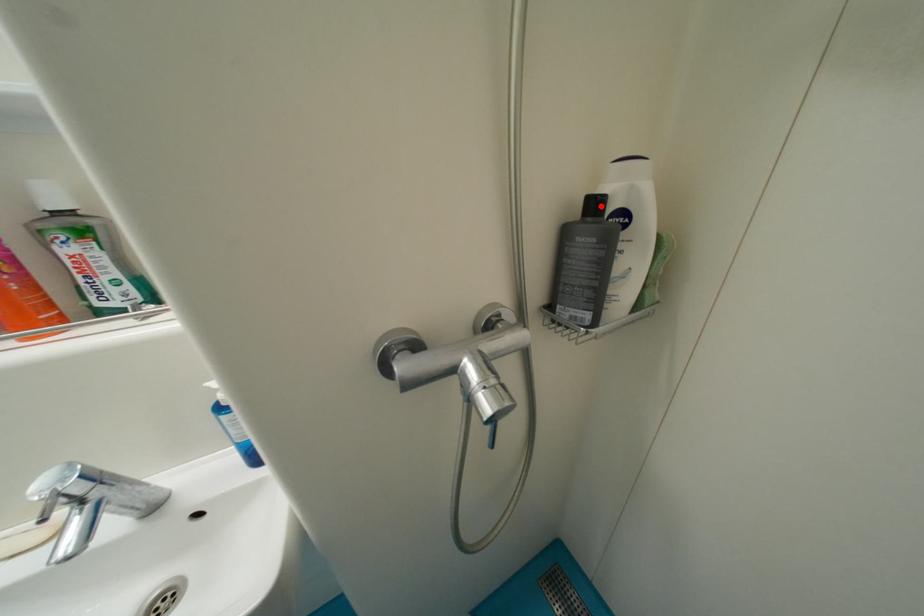
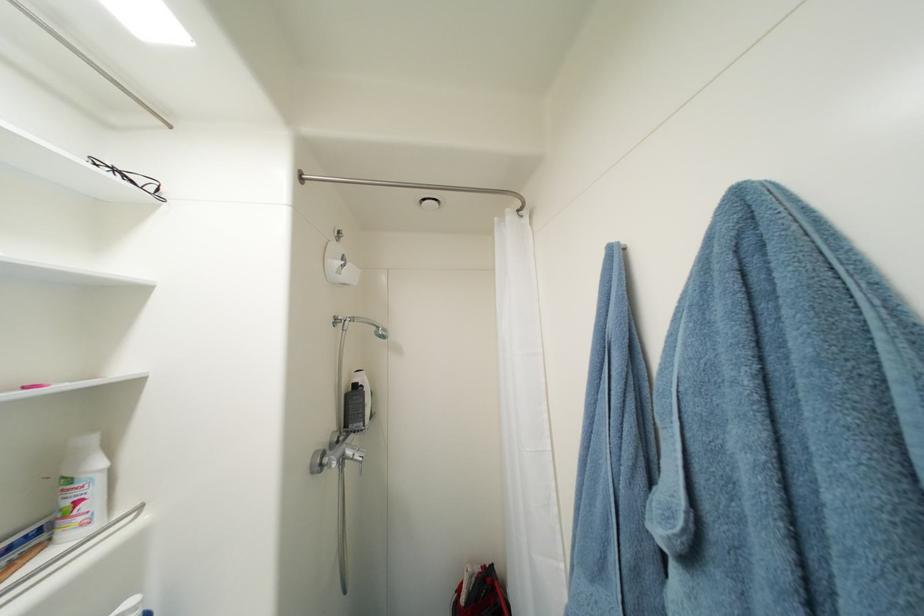
In the second image, find the point that corresponds to the highlighted location in the first image.

(361, 387)